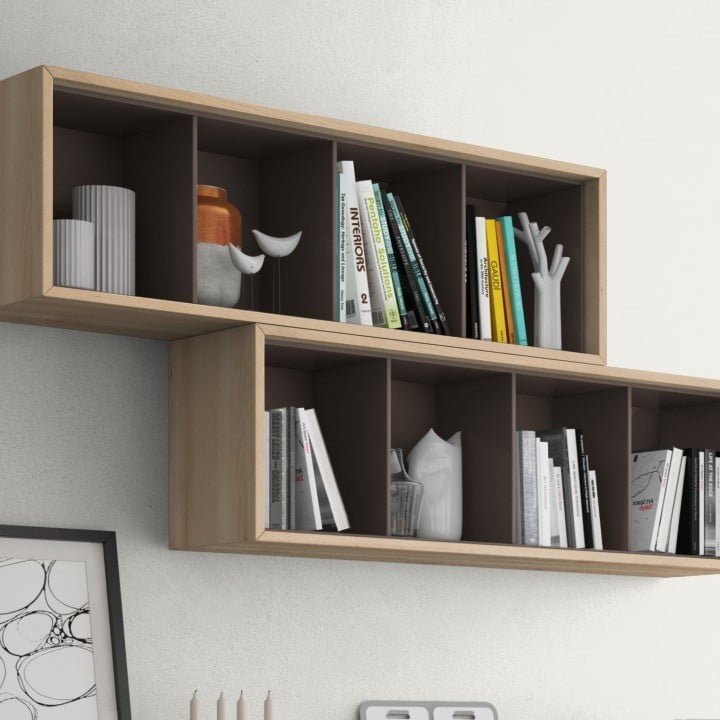
The height and width of the screenshot is (720, 720). In order to click on art objects in this screenshot , I will do `click(443, 453)`, `click(276, 243)`, `click(247, 271)`, `click(204, 215)`, `click(112, 215)`, `click(72, 243)`, `click(552, 314)`.